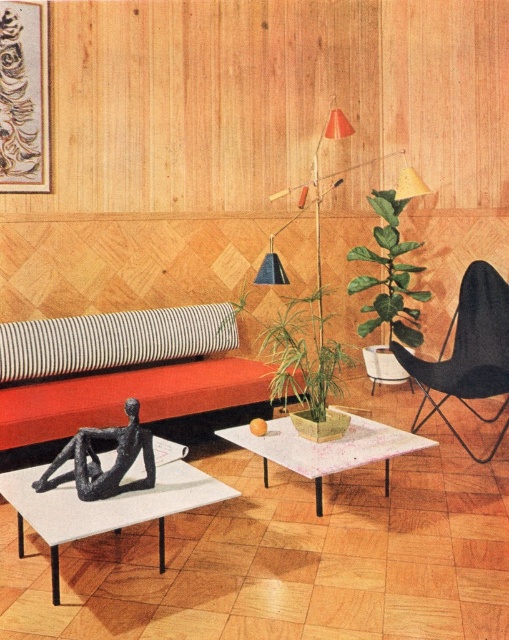
In the scene shown: You are a guest entering the living room and want to sit down comfortably. Which object between the matte orange couch at center and the black matte sculpture at lower left is more suitable for sitting?

The matte orange couch at center is more suitable for sitting because it has a greater height compared to the black matte sculpture at lower left, making it a more comfortable seating option.

You are sitting on the matte orange couch at center and want to pick up the black matte sculpture at lower left. Can you reach it without moving from the couch?

The black matte sculpture at lower left is behind the matte orange couch at center, so you cannot reach it without moving from the couch.